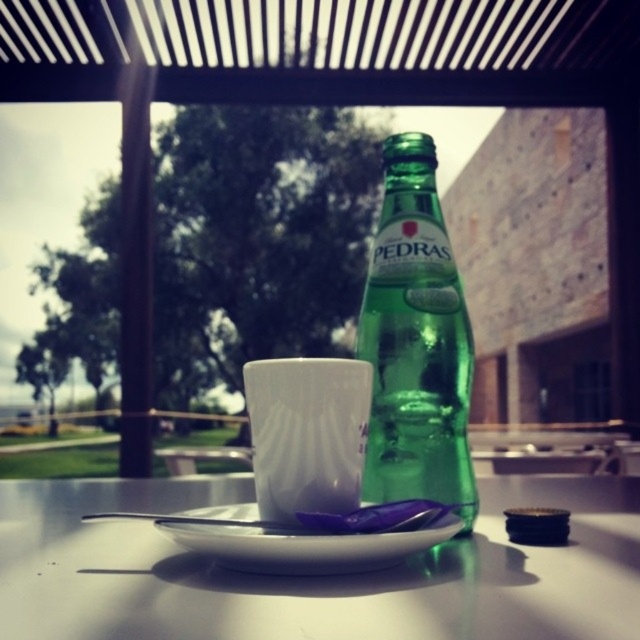
Question: Is white glossy plate at center bigger than green glass bottle at center?

Choices:
 (A) no
 (B) yes

Answer: (B)

Question: Which of these objects is positioned closest to the white glossy mug at center?

Choices:
 (A) white glossy saucer at center
 (B) white glossy plate at center

Answer: (A)

Question: Estimate the real-world distances between objects in this image. Which object is closer to the white glossy mug at center?

Choices:
 (A) green glass bottle at center
 (B) white glossy plate at center

Answer: (A)

Question: Which object appears farthest from the camera in this image?

Choices:
 (A) white glossy mug at center
 (B) white glossy plate at center
 (C) green glass bottle at center

Answer: (C)

Question: Does white glossy plate at center have a larger size compared to white glossy saucer at center?

Choices:
 (A) yes
 (B) no

Answer: (A)

Question: Can you confirm if white glossy plate at center is smaller than white glossy mug at center?

Choices:
 (A) yes
 (B) no

Answer: (B)